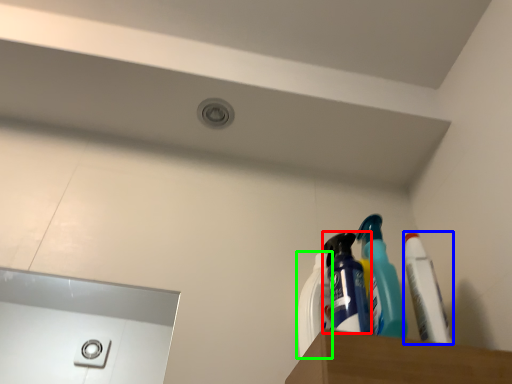
Question: Based on their relative distances, which object is nearer to cleaning product (highlighted by a red box)? Choose from toothpaste (highlighted by a blue box) and cleaning product (highlighted by a green box).

Choices:
 (A) toothpaste
 (B) cleaning product

Answer: (B)